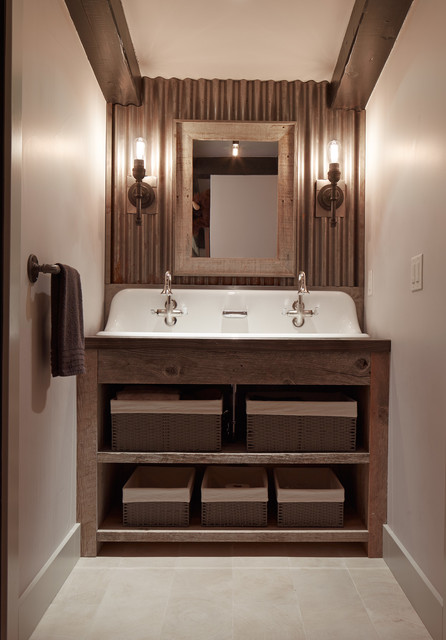
At what (x,y) coordinates should I click in order to perform the action: click on mirror. Please return your answer as a coordinate pair (x, y). Looking at the image, I should click on (243, 200).